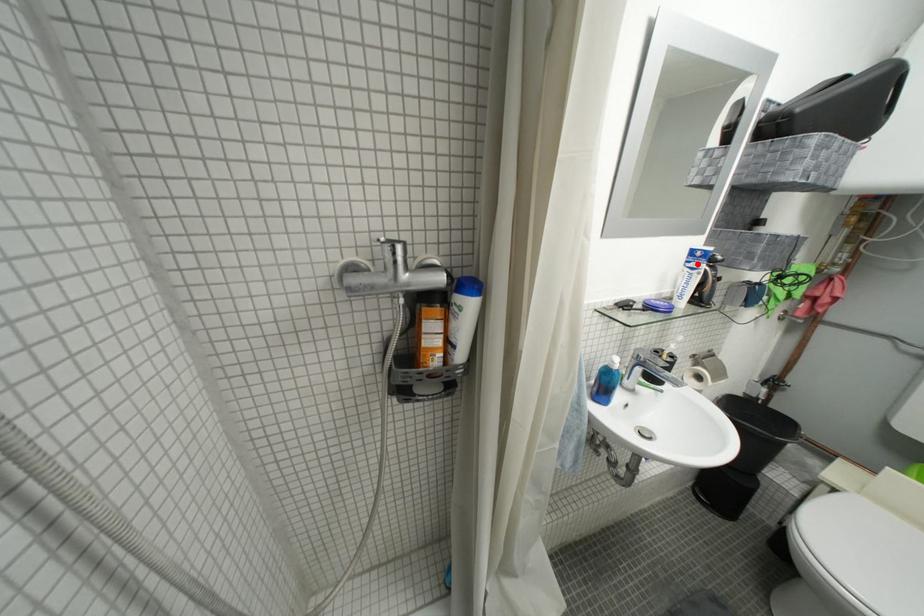
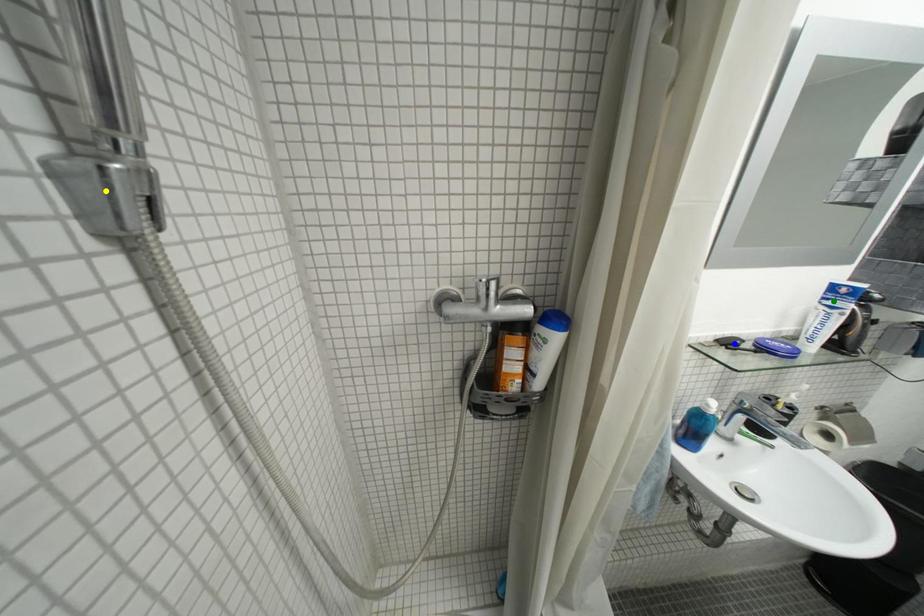
Question: I am providing you with two images of the same scene from different viewpoints. A red point is marked on the first image. You are given multiple points on the second image. In image 2, which mark is for the same physical point as the one in image 1?

Choices:
 (A) blue point
 (B) green point
 (C) yellow point

Answer: (B)